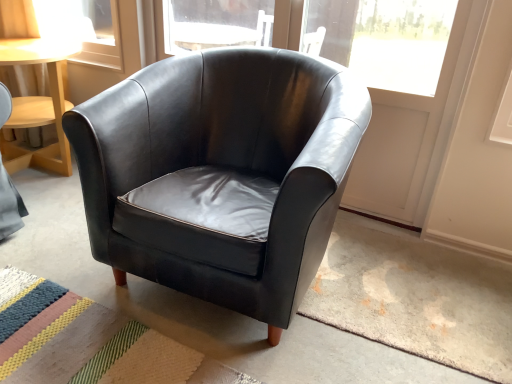
Question: From a real-world perspective, is striped woven mat at lower left above or below black leather armchair at center?

Choices:
 (A) below
 (B) above

Answer: (A)

Question: Considering the positions of point (136, 370) and point (325, 102), is point (136, 370) closer or farther from the camera than point (325, 102)?

Choices:
 (A) farther
 (B) closer

Answer: (B)

Question: Is striped woven mat at lower left bigger or smaller than black leather armchair at center?

Choices:
 (A) small
 (B) big

Answer: (A)

Question: Is black leather armchair at center spatially inside striped woven mat at lower left, or outside of it?

Choices:
 (A) inside
 (B) outside

Answer: (B)

Question: Is black leather armchair at center bigger or smaller than striped woven mat at lower left?

Choices:
 (A) small
 (B) big

Answer: (B)

Question: Considering the positions of black leather armchair at center and striped woven mat at lower left in the image, is black leather armchair at center wider or thinner than striped woven mat at lower left?

Choices:
 (A) wide
 (B) thin

Answer: (B)

Question: Does point (159, 246) appear closer or farther from the camera than point (53, 357)?

Choices:
 (A) farther
 (B) closer

Answer: (A)